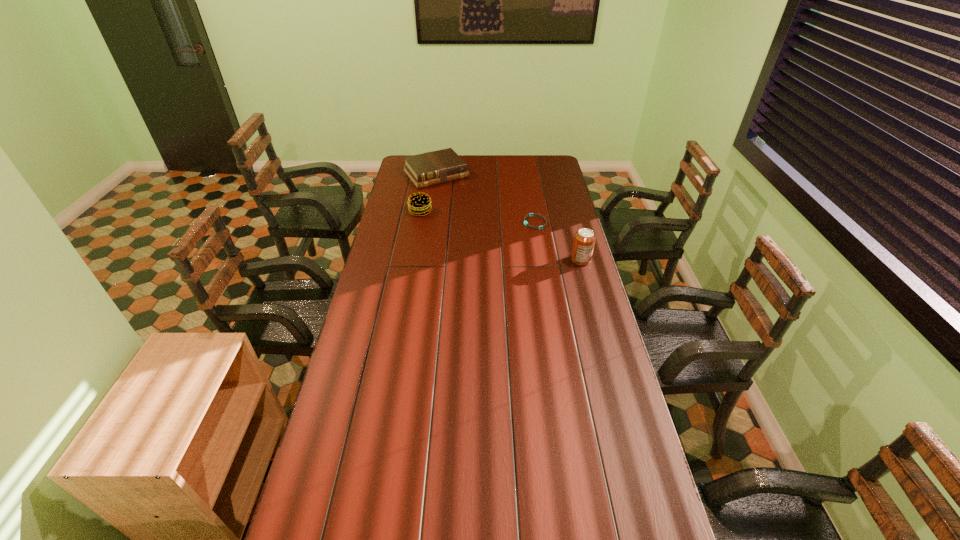
Where is `free space located 0.360m on the spine side of the farthest object`? The height and width of the screenshot is (540, 960). free space located 0.360m on the spine side of the farthest object is located at coordinates pyautogui.click(x=480, y=222).

This screenshot has width=960, height=540. In order to click on vacant space located 0.390m on the buckle of the wristband in this screenshot , I will do `click(451, 251)`.

Image resolution: width=960 pixels, height=540 pixels. I want to click on vacant space located on the buckle of the wristband, so click(483, 240).

I want to click on vacant space located 0.200m on the buckle of the wristband, so click(489, 238).

Locate an element on the screen. This screenshot has width=960, height=540. object positioned at the far edge is located at coordinates (437, 167).

Locate an element on the screen. The height and width of the screenshot is (540, 960). patty present at the left edge is located at coordinates click(x=419, y=204).

Locate an element on the screen. The image size is (960, 540). Bible at the left edge is located at coordinates (437, 167).

At what (x,y) coordinates should I click in order to perform the action: click on can positioned at the right edge. Please return your answer as a coordinate pair (x, y). This screenshot has height=540, width=960. Looking at the image, I should click on (584, 240).

Locate an element on the screen. This screenshot has width=960, height=540. wristband that is at the right edge is located at coordinates (530, 214).

Identify the location of object at the far left corner. (437, 167).